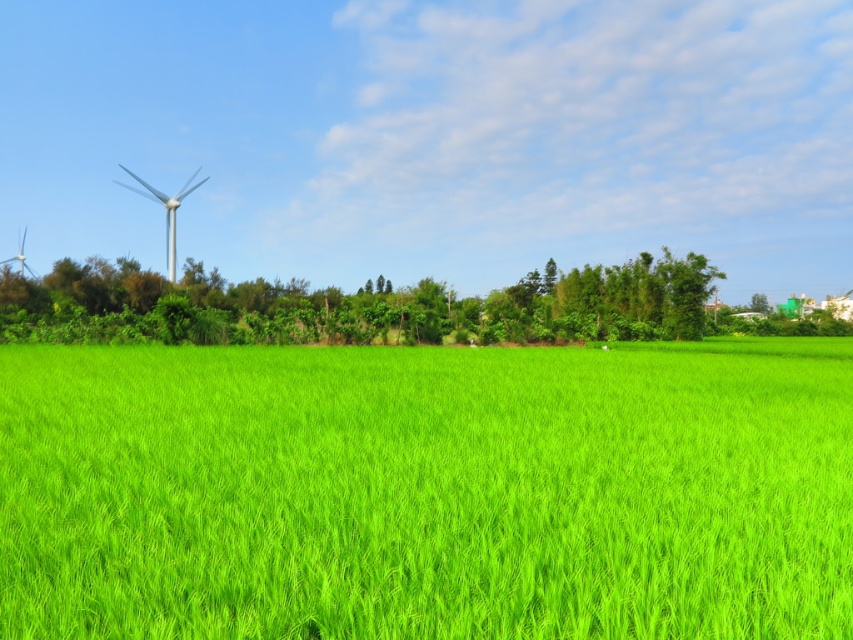
You are standing in the middle of the green grassy field at center and want to walk towards the green leafy tree at center. Which direction should you walk to get closer to the tree?

Since the green grassy field at center is in front of the green leafy tree at center, you should walk forward to get closer to the tree.

You are standing at the origin point of the coordinate system in the image. You want to walk towards the green leafy tree at center. What are the coordinates you need to move to reach it?

The coordinates to reach the green leafy tree at center are at point (357, 307).